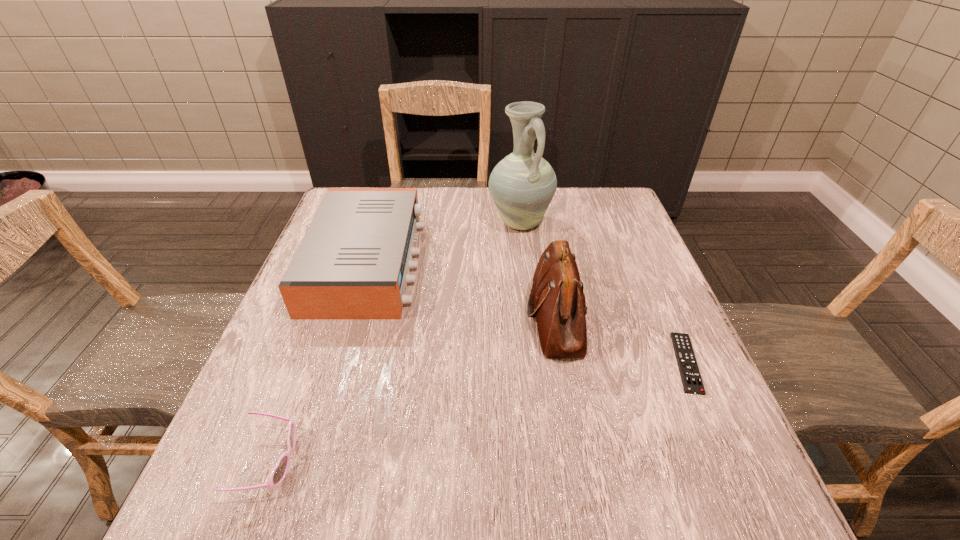
The width and height of the screenshot is (960, 540). Find the location of `free region at the far edge`. free region at the far edge is located at coordinates (444, 211).

The height and width of the screenshot is (540, 960). I want to click on free space at the near edge, so click(x=383, y=481).

Where is `vacant space at the left edge of the desktop`? This screenshot has height=540, width=960. vacant space at the left edge of the desktop is located at coordinates (349, 335).

In order to click on vacant space at the right edge in this screenshot , I will do `click(669, 359)`.

In the image, there is a desktop. Identify the location of free region at the far right corner. This screenshot has width=960, height=540. (616, 204).

Where is `free space at the near right corner of the desktop`? This screenshot has height=540, width=960. free space at the near right corner of the desktop is located at coordinates (772, 521).

Identify the location of unoccupied position between the nearest object and the third shortest object. Image resolution: width=960 pixels, height=540 pixels. [x=319, y=362].

What are the coordinates of `free space between the second tallest object and the rightmost object` in the screenshot? It's located at (621, 340).

I want to click on free space between the remote control and the pitcher, so click(603, 293).

You are a GUI agent. You are given a task and a screenshot of the screen. Output one action in this format:
    pyautogui.click(x=<x>, y=<y>)
    Task: Click on the vacant area that lies between the radio receiver and the pitcher
    
    Given the screenshot: What is the action you would take?
    pyautogui.click(x=444, y=242)